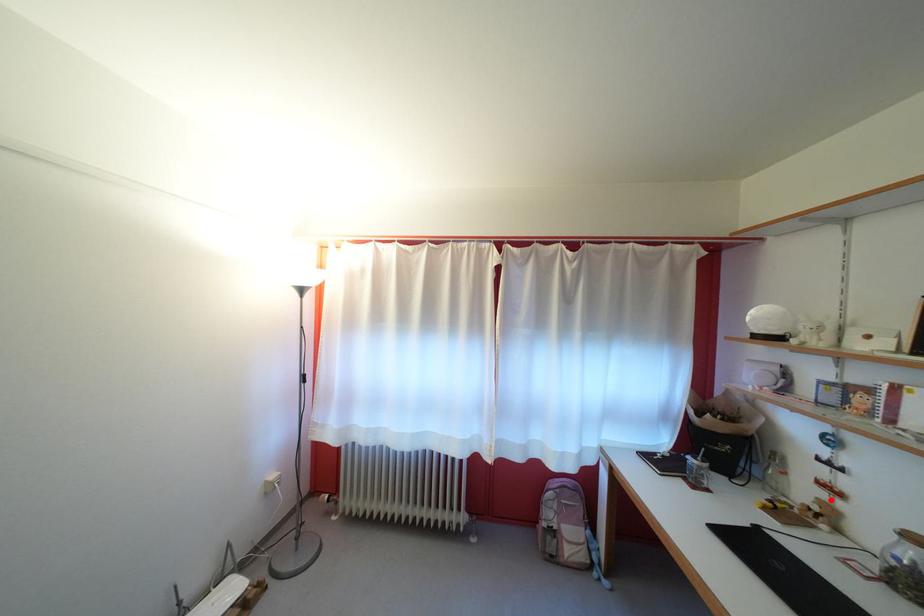
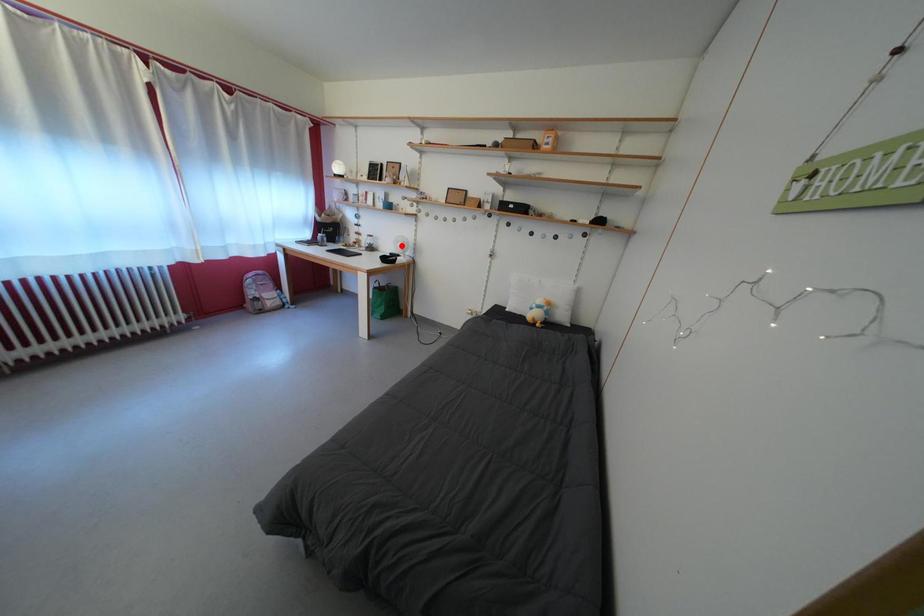
I am providing you with two images of the same scene from different viewpoints. A red point is marked on the first image and another point is marked on the second image. Is the marked point in image1 the same physical position as the marked point in image2?

No